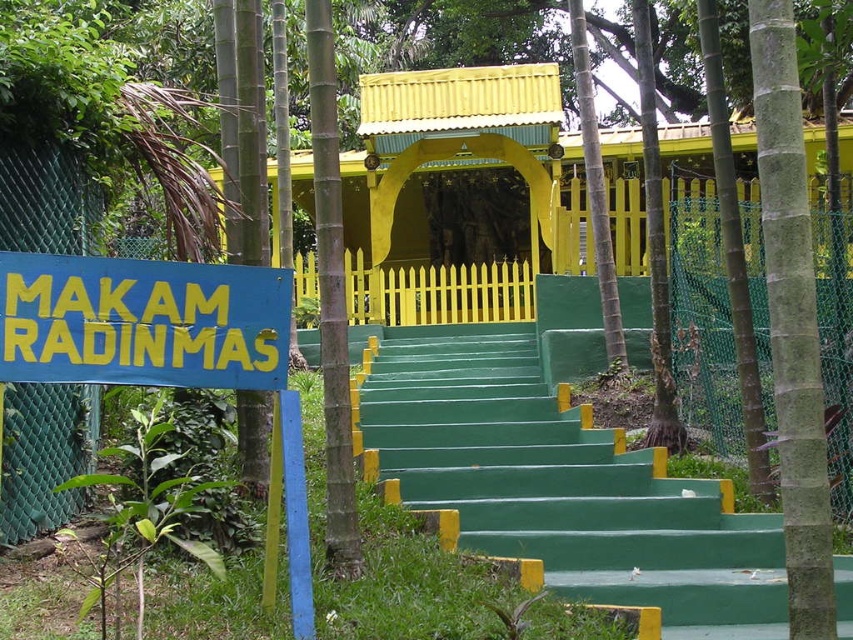
Question: Which point appears closest to the camera in this image?

Choices:
 (A) (27, 314)
 (B) (755, 637)

Answer: (A)

Question: Considering the relative positions of green painted stairs at center and blue painted signboard at left in the image provided, where is green painted stairs at center located with respect to blue painted signboard at left?

Choices:
 (A) above
 (B) below

Answer: (B)

Question: Among these points, which one is farthest from the camera?

Choices:
 (A) (115, 275)
 (B) (495, 428)

Answer: (B)

Question: Observing the image, what is the correct spatial positioning of green painted stairs at center in reference to blue painted signboard at left?

Choices:
 (A) below
 (B) above

Answer: (A)

Question: From the image, what is the correct spatial relationship of green painted stairs at center in relation to blue painted signboard at left?

Choices:
 (A) right
 (B) left

Answer: (A)